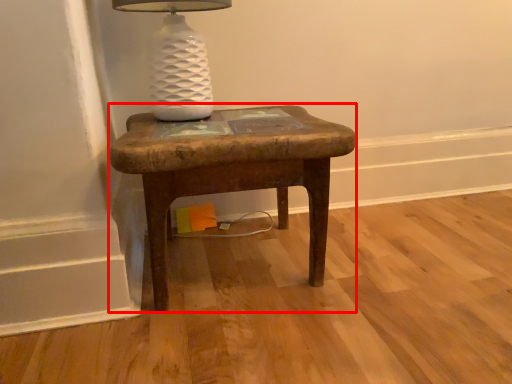
Question: From the image's perspective, considering the relative positions of stool (annotated by the red box) and table lamp in the image provided, where is stool (annotated by the red box) located with respect to the staircase?

Choices:
 (A) above
 (B) below

Answer: (B)